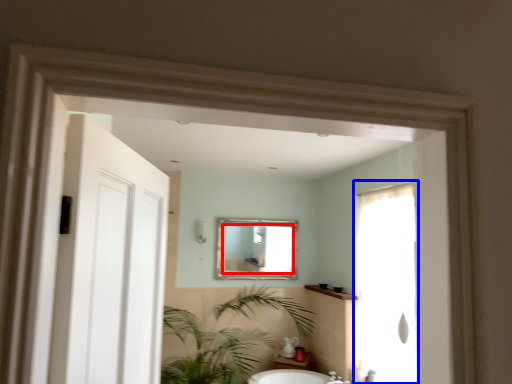
Question: Which object appears closest to the camera in this image, mirror (highlighted by a red box) or screen door (highlighted by a blue box)?

Choices:
 (A) mirror
 (B) screen door

Answer: (B)